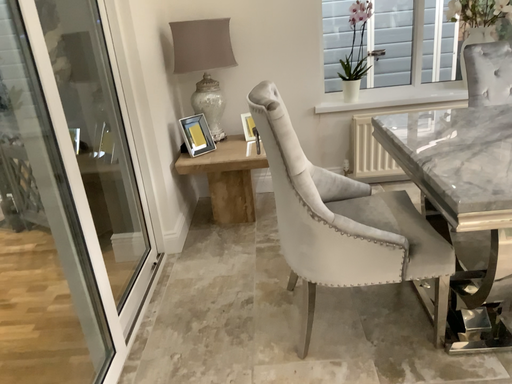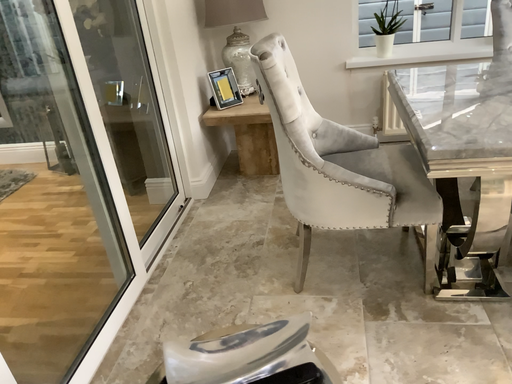
Question: How did the camera likely rotate when shooting the video?

Choices:
 (A) rotated right
 (B) rotated left

Answer: (B)